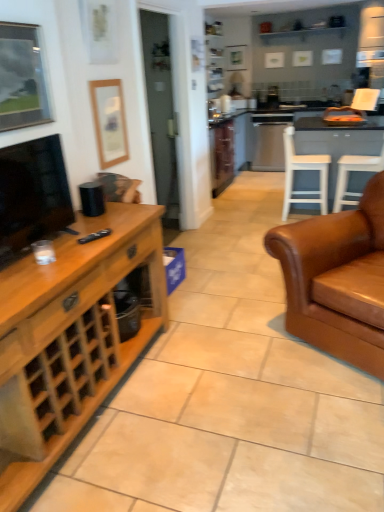
Question: Is white plastic chair at right, the 1th chair in the right-to-left sequence, wider than metallic silver picture frame at upper left, which is the second picture frame from back to front?

Choices:
 (A) no
 (B) yes

Answer: (B)

Question: From a real-world perspective, is white plastic chair at right, the 1th chair in the right-to-left sequence, located beneath metallic silver picture frame at upper left, which ranks as the second picture frame in right-to-left order?

Choices:
 (A) yes
 (B) no

Answer: (A)

Question: Is metallic silver picture frame at upper left, which appears as the first picture frame when viewed from the left, at the back of white plastic chair at right, the 1th chair in the right-to-left sequence?

Choices:
 (A) no
 (B) yes

Answer: (A)

Question: Is white plastic chair at right, the 1th chair in the right-to-left sequence, shorter than metallic silver picture frame at upper left, arranged as the 1th picture frame when viewed from the front?

Choices:
 (A) yes
 (B) no

Answer: (B)

Question: Is white plastic chair at right, which is the second chair from left to right, outside metallic silver picture frame at upper left, which appears as the first picture frame when viewed from the left?

Choices:
 (A) yes
 (B) no

Answer: (A)

Question: Does white plastic chair at right, the 1th chair in the right-to-left sequence, have a lesser width compared to metallic silver picture frame at upper left, arranged as the 1th picture frame when viewed from the front?

Choices:
 (A) yes
 (B) no

Answer: (B)

Question: Can you confirm if white wood table at right is thinner than white wood chair at center, the 2th chair from the right?

Choices:
 (A) yes
 (B) no

Answer: (B)

Question: From the image's perspective, is white wood table at right under white wood chair at center, the 2th chair from the right?

Choices:
 (A) yes
 (B) no

Answer: (B)

Question: Is white wood table at right positioned behind white wood chair at center, the 2th chair from the right?

Choices:
 (A) no
 (B) yes

Answer: (B)

Question: From a real-world perspective, is white wood table at right located beneath white wood chair at center, the 2th chair from the right?

Choices:
 (A) yes
 (B) no

Answer: (A)

Question: Does white wood table at right have a greater width compared to white wood chair at center, positioned as the 1th chair in left-to-right order?

Choices:
 (A) yes
 (B) no

Answer: (A)

Question: Can you confirm if white wood table at right is bigger than white wood chair at center, positioned as the 1th chair in left-to-right order?

Choices:
 (A) no
 (B) yes

Answer: (B)

Question: Is black matte remote at center thinner than white plastic chair at right, which is the second chair from left to right?

Choices:
 (A) no
 (B) yes

Answer: (B)